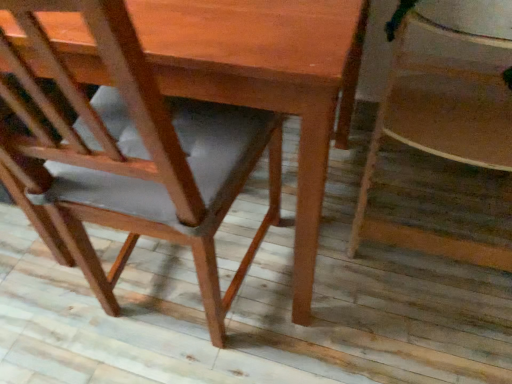
Question: Which direction should I rotate to look at matte brown chair at center, positioned as the 2th chair in right-to-left order?

Choices:
 (A) left
 (B) right

Answer: (A)

Question: Considering the relative sizes of matte brown chair at center, the 1th chair when ordered from left to right, and wooden chair at lower right, which is the 1th chair from right to left, in the image provided, is matte brown chair at center, the 1th chair when ordered from left to right, wider than wooden chair at lower right, which is the 1th chair from right to left,?

Choices:
 (A) yes
 (B) no

Answer: (A)

Question: Is matte brown chair at center, the 1th chair when ordered from left to right, facing towards wooden chair at lower right, which is the 1th chair from right to left?

Choices:
 (A) no
 (B) yes

Answer: (A)

Question: From a real-world perspective, is matte brown chair at center, positioned as the 2th chair in right-to-left order, under wooden chair at lower right, the second chair from the left?

Choices:
 (A) yes
 (B) no

Answer: (B)

Question: Is matte brown chair at center, the 1th chair when ordered from left to right, completely or partially outside of wooden chair at lower right, which is the 1th chair from right to left?

Choices:
 (A) yes
 (B) no

Answer: (A)

Question: Is matte brown chair at center, positioned as the 2th chair in right-to-left order, surrounding wooden chair at lower right, which is the 1th chair from right to left?

Choices:
 (A) no
 (B) yes

Answer: (A)

Question: From the image's perspective, is matte brown chair at center, the 1th chair when ordered from left to right, on top of wooden chair at lower right, the second chair from the left?

Choices:
 (A) no
 (B) yes

Answer: (A)

Question: Would you say wooden chair at lower right, which is the 1th chair from right to left, contains matte brown chair at center, the 1th chair when ordered from left to right?

Choices:
 (A) yes
 (B) no

Answer: (B)

Question: From a real-world perspective, is wooden chair at lower right, which is the 1th chair from right to left, located higher than matte brown chair at center, the 1th chair when ordered from left to right?

Choices:
 (A) yes
 (B) no

Answer: (B)

Question: Can you confirm if wooden chair at lower right, which is the 1th chair from right to left, is positioned to the right of matte brown chair at center, positioned as the 2th chair in right-to-left order?

Choices:
 (A) yes
 (B) no

Answer: (A)

Question: Does wooden chair at lower right, the second chair from the left, have a lesser width compared to matte brown chair at center, the 1th chair when ordered from left to right?

Choices:
 (A) no
 (B) yes

Answer: (B)

Question: From the image's perspective, does wooden chair at lower right, which is the 1th chair from right to left, appear lower than matte brown chair at center, the 1th chair when ordered from left to right?

Choices:
 (A) yes
 (B) no

Answer: (B)

Question: From the image's perspective, is wooden chair at lower right, which is the 1th chair from right to left, above matte brown chair at center, the 1th chair when ordered from left to right?

Choices:
 (A) yes
 (B) no

Answer: (A)

Question: Is wooden chair at lower right, which is the 1th chair from right to left, taller or shorter than matte brown chair at center, the 1th chair when ordered from left to right?

Choices:
 (A) short
 (B) tall

Answer: (A)